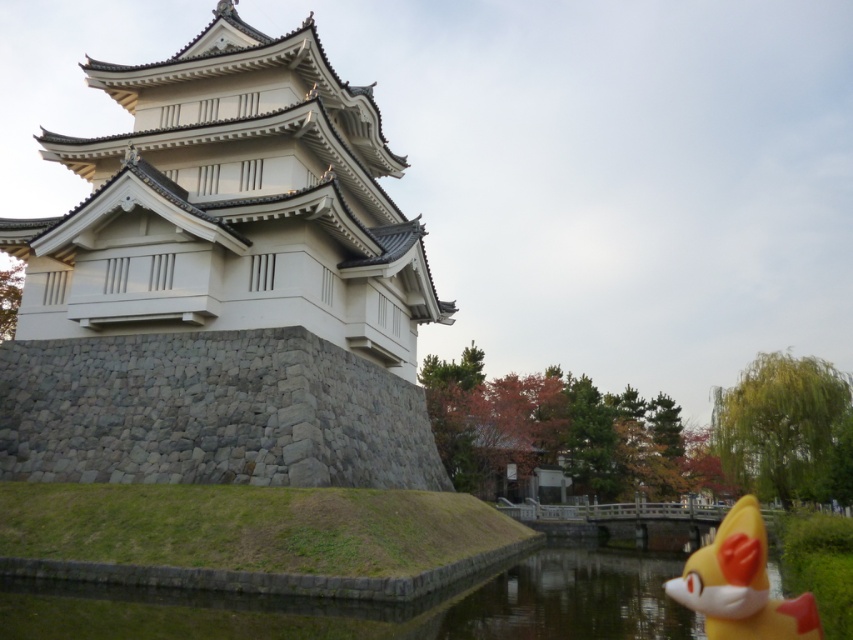
You are a visitor standing at the edge of the small body of water in front of the traditional Japanese structure. You notice the white stone tower at center and the yellow matte fox at lower right. Which object appears larger in the image?

The white stone tower at center appears larger than the yellow matte fox at lower right because it is much taller as stated in the description.

You are an architect designing a miniature model of the scene. The white stone tower at center and the yellow matte fox at lower right must be included. Which object should you make wider in your model to stay true to the original image?

The white stone tower at center should be made wider in the model since its width is larger than the yellow matte fox at lower right in the original image.

You are standing in front of the Japanese castle structure and want to take a photo. You notice two points marked in the image. The first point is at coordinates point (x=334, y=627) and the second point is at point (x=782, y=608). Which of these points is closer to your camera position?

Point (x=334, y=627) is further to the camera than point (x=782, y=608), so the point closer to the camera is point (x=782, y=608).